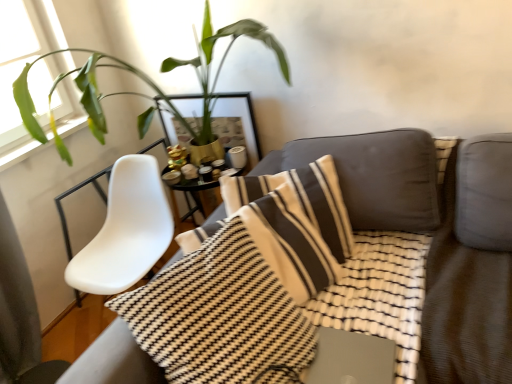
Question: From the image's perspective, is metallic silver laptop at center under gold metallic picture frame at upper center?

Choices:
 (A) no
 (B) yes

Answer: (B)

Question: Are metallic silver laptop at center and gold metallic picture frame at upper center far apart?

Choices:
 (A) yes
 (B) no

Answer: (A)

Question: Is metallic silver laptop at center positioned behind gold metallic picture frame at upper center?

Choices:
 (A) yes
 (B) no

Answer: (B)

Question: Is the depth of metallic silver laptop at center less than that of gold metallic picture frame at upper center?

Choices:
 (A) yes
 (B) no

Answer: (A)

Question: From a real-world perspective, is metallic silver laptop at center on top of gold metallic picture frame at upper center?

Choices:
 (A) yes
 (B) no

Answer: (B)

Question: Would you say gold metallic picture frame at upper center is inside or outside green leafy plant at upper left?

Choices:
 (A) outside
 (B) inside

Answer: (A)

Question: From a real-world perspective, is gold metallic picture frame at upper center positioned above or below green leafy plant at upper left?

Choices:
 (A) below
 (B) above

Answer: (A)

Question: Is gold metallic picture frame at upper center taller or shorter than green leafy plant at upper left?

Choices:
 (A) tall
 (B) short

Answer: (B)

Question: Looking at their shapes, would you say gold metallic picture frame at upper center is wider or thinner than green leafy plant at upper left?

Choices:
 (A) thin
 (B) wide

Answer: (A)

Question: Do you think green leafy plant at upper left is within metallic silver laptop at center, or outside of it?

Choices:
 (A) outside
 (B) inside

Answer: (A)

Question: From the image's perspective, is green leafy plant at upper left positioned above or below metallic silver laptop at center?

Choices:
 (A) above
 (B) below

Answer: (A)

Question: Considering the relative positions of green leafy plant at upper left and metallic silver laptop at center in the image provided, is green leafy plant at upper left to the left or to the right of metallic silver laptop at center?

Choices:
 (A) left
 (B) right

Answer: (A)

Question: Is green leafy plant at upper left wider or thinner than metallic silver laptop at center?

Choices:
 (A) thin
 (B) wide

Answer: (B)

Question: Is textured gray couch at center taller or shorter than green leafy plant at upper left?

Choices:
 (A) short
 (B) tall

Answer: (B)

Question: Based on their positions, is textured gray couch at center located to the left or right of green leafy plant at upper left?

Choices:
 (A) left
 (B) right

Answer: (B)